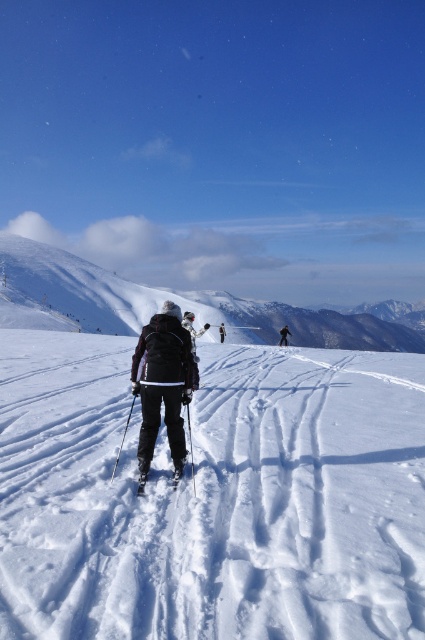
You are a photographer capturing the winter scene. You notice the white matte ski at center and the dark gray ski suit at center. Which object is located to the left of the other?

The white matte ski at center is positioned on the left side of dark gray ski suit at center.

You are a photographer planning to take a picture of the winter scene. You want to focus on the white powdery snow at center. According to the coordinates provided, where should you aim your camera? Please specify the coordinates in the format of a point like point (212,497).

The white powdery snow at center is located at point (212,497). You should aim your camera at this coordinate to capture it.

Consider the image. You are a photographer trying to capture the skier in the snow scene. You notice the white matte ski at center and the black ski suit at center. Which object would be harder to see against the snowy background, and why?

The black ski suit at center would be harder to see against the snowy background because it has a darker color compared to the white matte ski at center, which blends better with the snow.